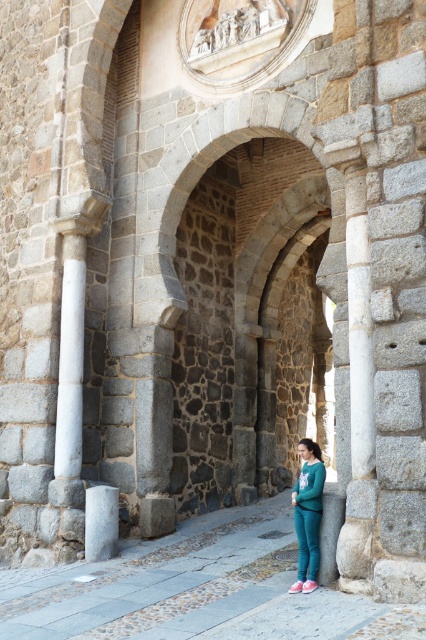
Is point (316, 560) farther from camera compared to point (97, 516)?

No, it is not.

Between teal fleece pants at lower right and gray stone pillar at center, which one appears on the right side from the viewer's perspective?

teal fleece pants at lower right

The width and height of the screenshot is (426, 640). I want to click on teal fleece pants at lower right, so click(x=307, y=515).